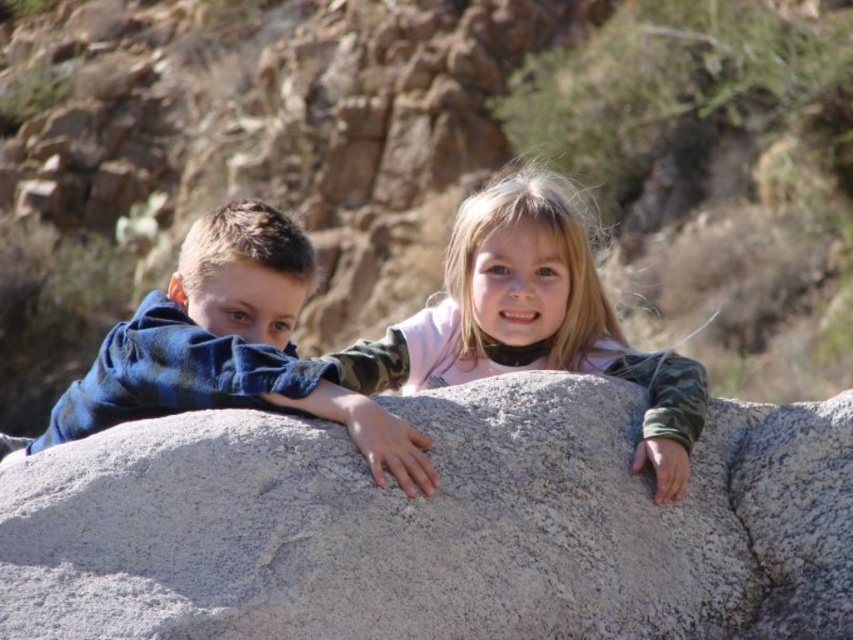
Looking at this image, does gray rough rock at center have a smaller size compared to blue denim jacket at left?

Yes.

Does gray rough rock at center have a greater height compared to blue denim jacket at left?

Incorrect, gray rough rock at center's height is not larger of blue denim jacket at left's.

Image resolution: width=853 pixels, height=640 pixels. What do you see at coordinates (436, 525) in the screenshot?
I see `gray rough rock at center` at bounding box center [436, 525].

The height and width of the screenshot is (640, 853). Find the location of `gray rough rock at center`. gray rough rock at center is located at coordinates coord(436,525).

Does light pink fabric at center have a greater width compared to blue denim jacket at left?

No.

Which is more to the left, light pink fabric at center or blue denim jacket at left?

blue denim jacket at left

Where is `light pink fabric at center`? The width and height of the screenshot is (853, 640). light pink fabric at center is located at coordinates (532, 320).

At what (x,y) coordinates should I click in order to perform the action: click on gray rough rock at center. Please return your answer as a coordinate pair (x, y). Looking at the image, I should click on (436, 525).

From the picture: Is gray rough rock at center above light pink fabric at center?

No, gray rough rock at center is not above light pink fabric at center.

Is point (500, 628) farther from camera compared to point (689, 442)?

No, it is not.

Where is `gray rough rock at center`? gray rough rock at center is located at coordinates (436, 525).